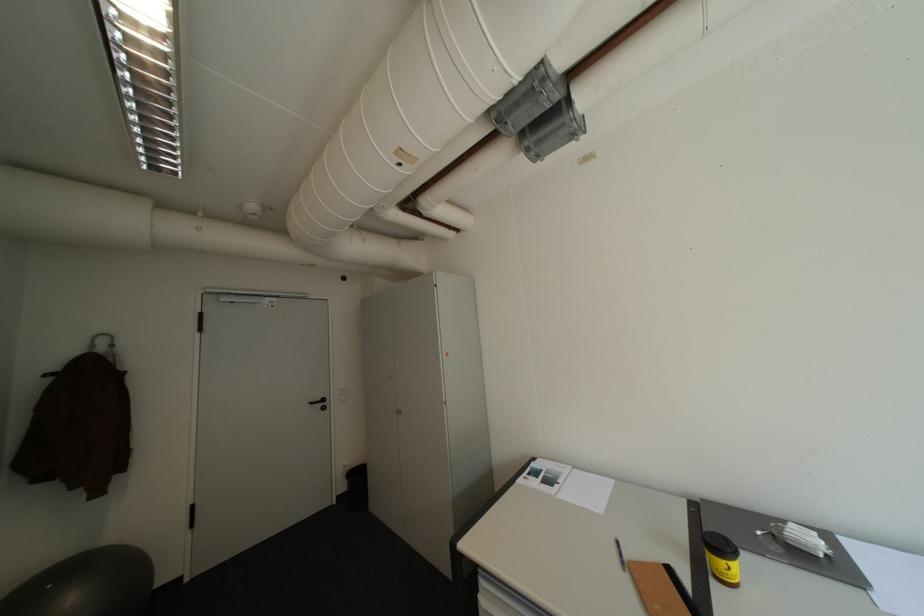
The location [619,554] corresponds to which object?

This point indicates the blue and white pen.